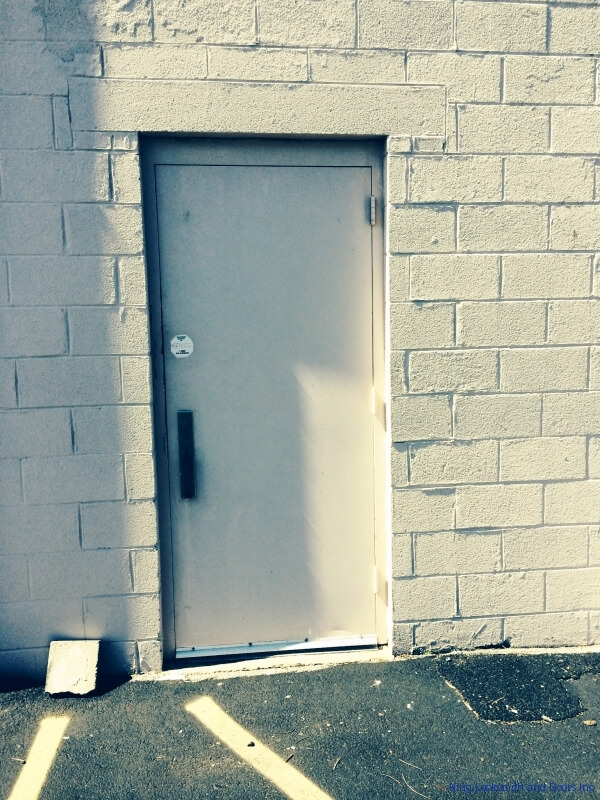
The image size is (600, 800). What are the coordinates of `door` in the screenshot? It's located at (251, 350).